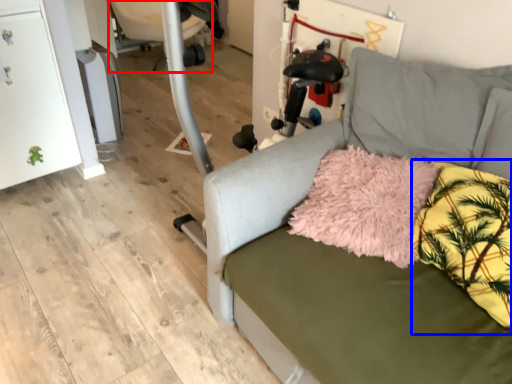
Question: Which of the following is the farthest to the observer, swivel chair (highlighted by a red box) or pillow (highlighted by a blue box)?

Choices:
 (A) swivel chair
 (B) pillow

Answer: (A)